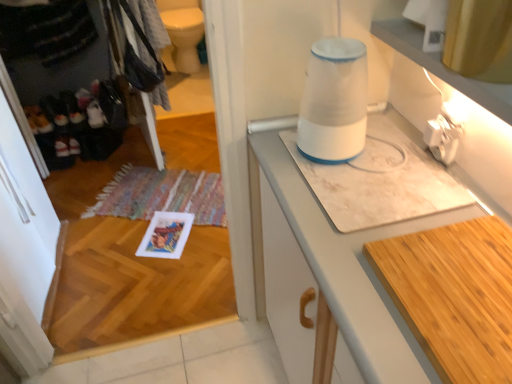
Where is `vacant space situated above multicolored woven mat at lower left (from a real-world perspective)`? This screenshot has height=384, width=512. vacant space situated above multicolored woven mat at lower left (from a real-world perspective) is located at coordinates (166, 188).